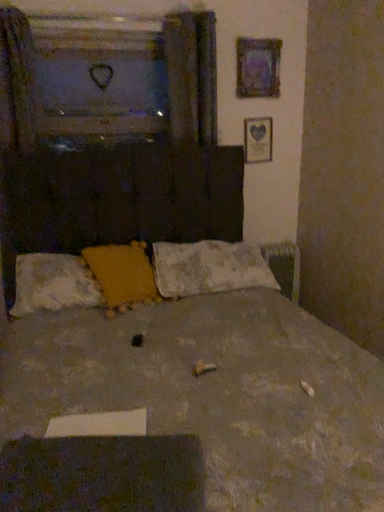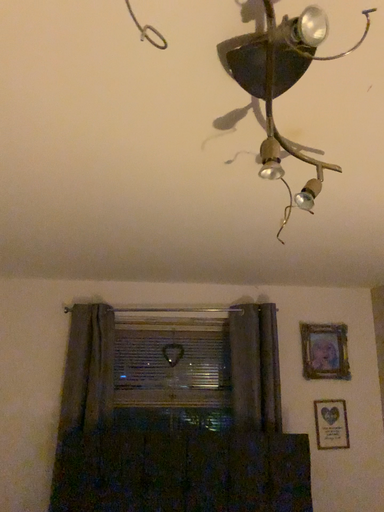
Question: Which way did the camera rotate in the video?

Choices:
 (A) rotated downward
 (B) rotated upward

Answer: (B)